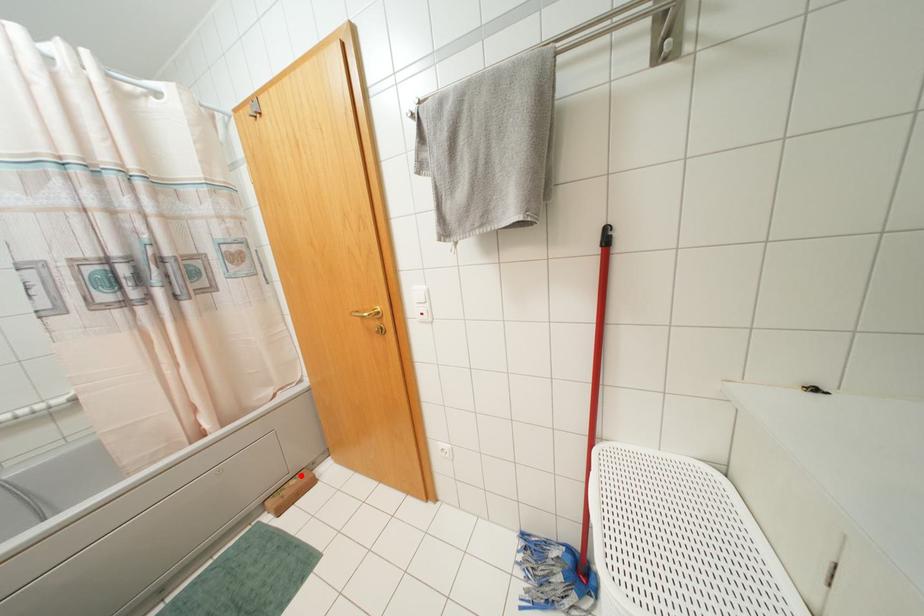
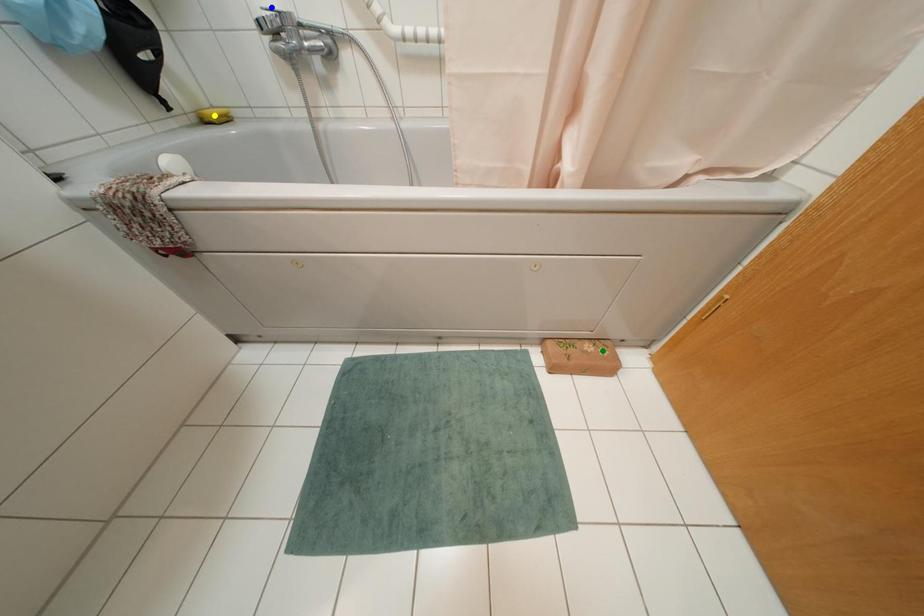
Question: I am providing you with two images of the same scene from different viewpoints. A red point is marked on the first image. You are given multiple points on the second image. Which mark in image 2 goes with the point in image 1?

Choices:
 (A) yellow point
 (B) green point
 (C) blue point

Answer: (B)